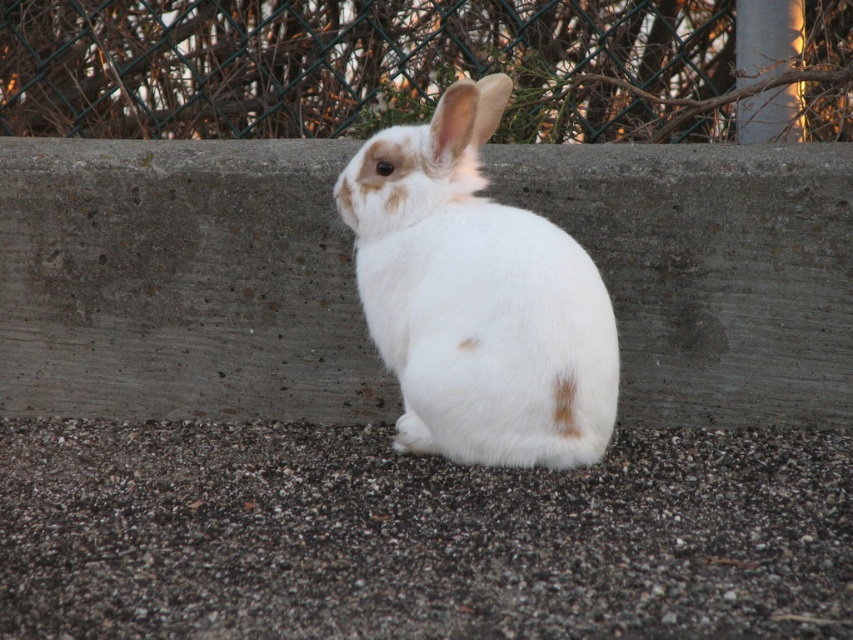
Question: Where is gray concrete at center located in relation to green wire mesh at upper center in the image?

Choices:
 (A) above
 (B) below

Answer: (B)

Question: Which point is farther to the camera?

Choices:
 (A) (622, 108)
 (B) (541, 332)

Answer: (A)

Question: Which point is farther to the camera?

Choices:
 (A) gray gravel at lower center
 (B) gray concrete at center

Answer: (B)

Question: Is gray gravel at lower center to the right of white fluffy rabbit at center from the viewer's perspective?

Choices:
 (A) no
 (B) yes

Answer: (A)

Question: Is gray gravel at lower center further to the viewer compared to white fluffy rabbit at center?

Choices:
 (A) yes
 (B) no

Answer: (B)

Question: Which point is farther from the camera taking this photo?

Choices:
 (A) (572, 580)
 (B) (722, 172)
 (C) (543, 330)

Answer: (B)